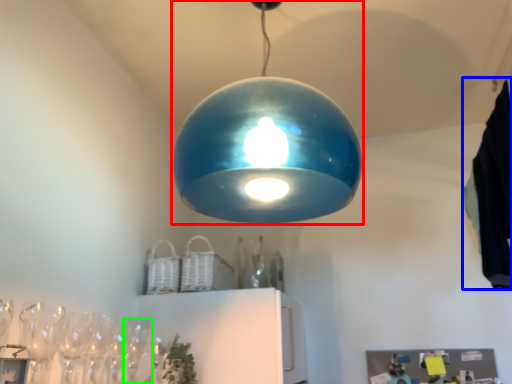
Question: Which object is positioned closest to lamp (highlighted by a red box)? Select from laundry (highlighted by a blue box) and wine glass (highlighted by a green box).

Choices:
 (A) laundry
 (B) wine glass

Answer: (A)